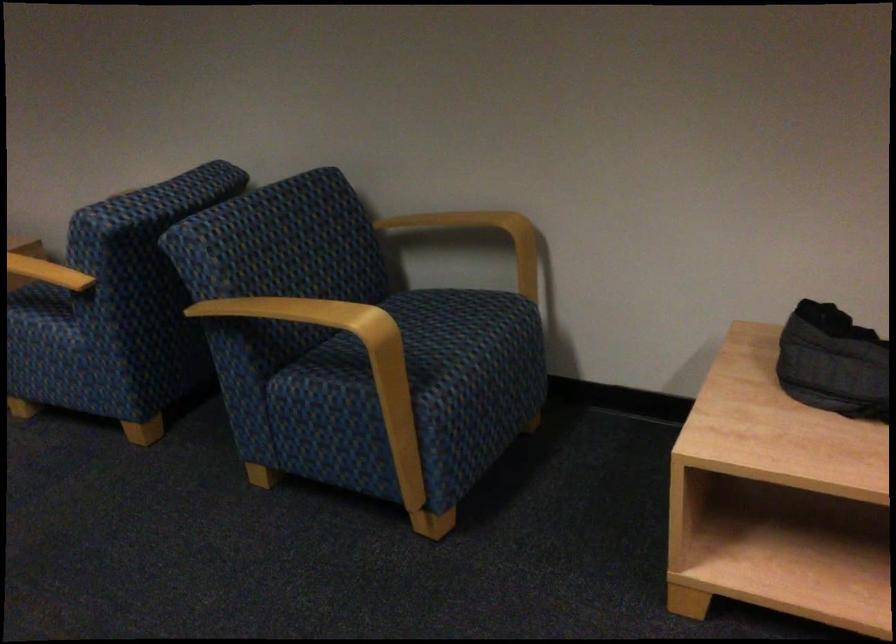
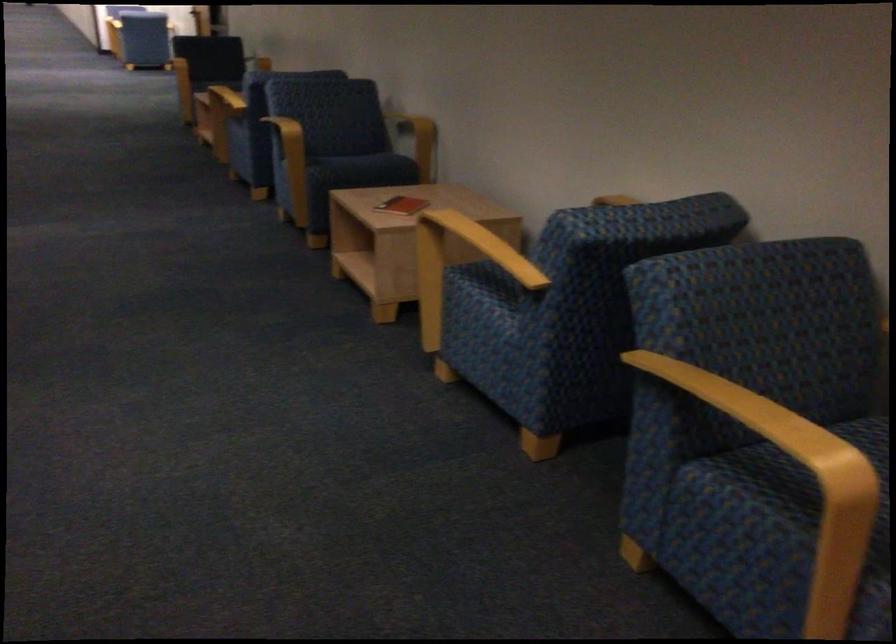
Question: The images are taken continuously from a first-person perspective. In which direction is your viewpoint rotating?

Choices:
 (A) Left
 (B) Right
 (C) Up
 (D) Down

Answer: (A)